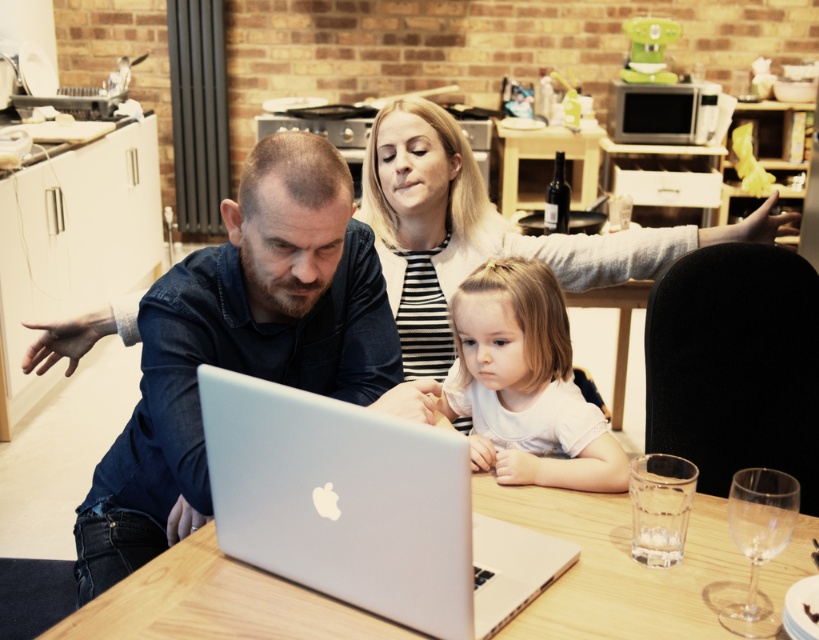
You are standing in the kitchen and need to place a new decorative plate exactly where the silver metallic laptop at center is currently located. What coordinates should you use to position the plate?

The coordinates for the silver metallic laptop at center are at point (364, 509), so you should place the decorative plate at those coordinates.

You are a photographer taking a picture of the scene. The silver metallic laptop at center and the white matte shirt at center are both in your viewfinder. Which object is positioned closer to the camera?

The silver metallic laptop at center is closer to the viewer than the white matte shirt at center, so it will appear closer to the camera in the photograph.